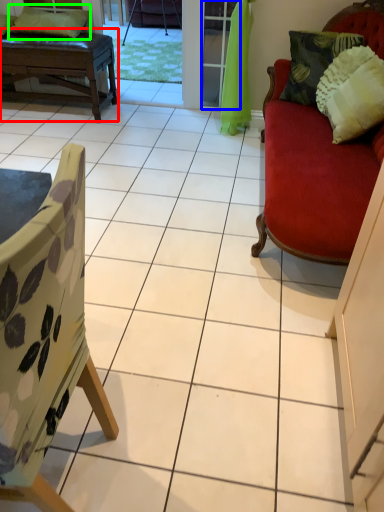
Question: Estimate the real-world distances between objects in this image. Which object is closer to table (highlighted by a red box), screen door (highlighted by a blue box) or pillow (highlighted by a green box)?

Choices:
 (A) screen door
 (B) pillow

Answer: (B)